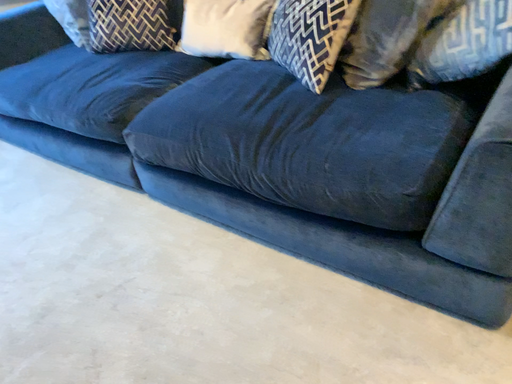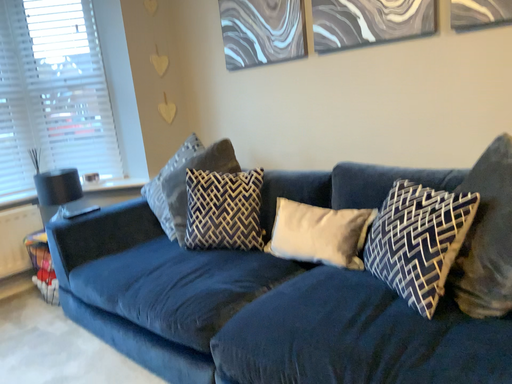
Question: How did the camera likely rotate when shooting the video?

Choices:
 (A) rotated downward
 (B) rotated upward

Answer: (B)